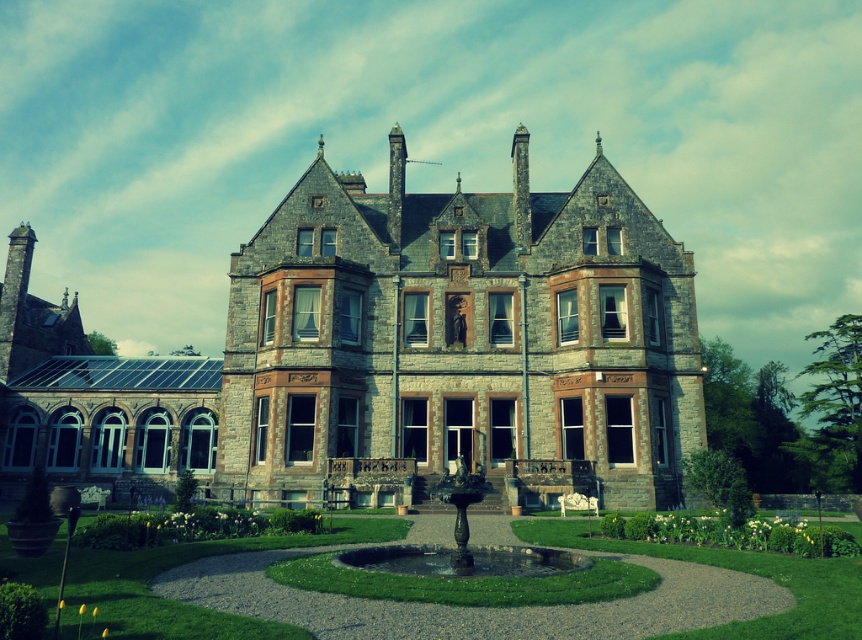
Can you confirm if stone mansion at center is taller than green grass at center?

Correct, stone mansion at center is much taller as green grass at center.

Is stone mansion at center below green grass at center?

No.

This screenshot has width=862, height=640. Find the location of `stone mansion at center`. stone mansion at center is located at coordinates (458, 337).

This screenshot has height=640, width=862. Find the location of `stone mansion at center`. stone mansion at center is located at coordinates (458, 337).

Between point (529, 468) and point (482, 570), which one is positioned in front?

Positioned in front is point (482, 570).

Is stone mansion at center positioned at the back of black stone fountain at center?

That is True.

The height and width of the screenshot is (640, 862). I want to click on stone mansion at center, so click(x=458, y=337).

Find the location of `stone mansion at center`. stone mansion at center is located at coordinates (458, 337).

Does point (47, 632) lie in front of point (558, 561)?

That is True.

Does point (355, 516) lie behind point (563, 570)?

That is True.

Where is `green grass at center`? The image size is (862, 640). green grass at center is located at coordinates click(x=178, y=602).